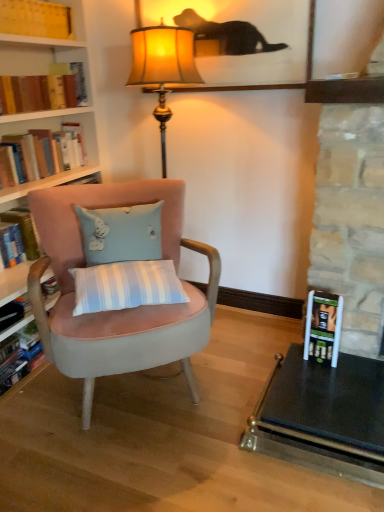
The image size is (384, 512). In order to click on space that is in front of velvet pink chair at center in this screenshot , I will do `click(138, 465)`.